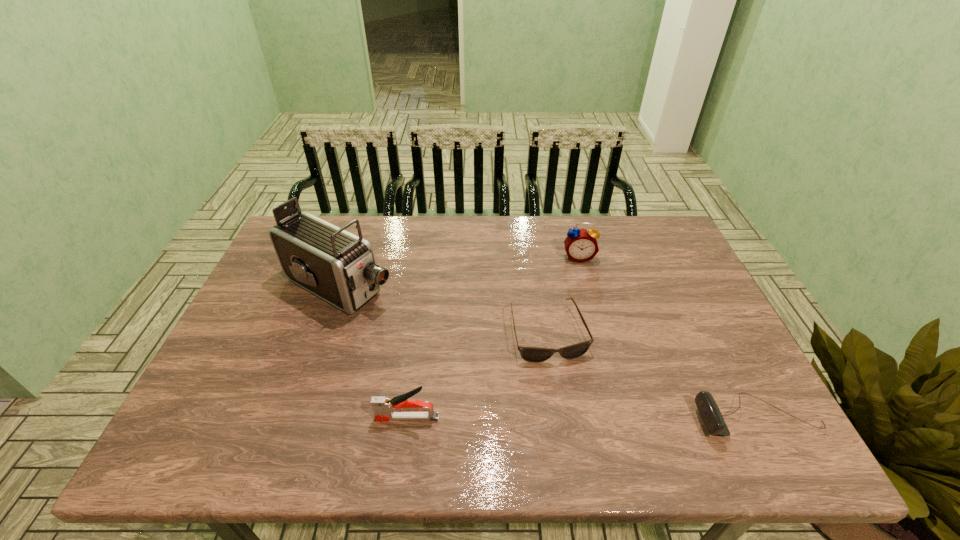
This screenshot has width=960, height=540. Identify the location of vacant space at the far edge of the desktop. (445, 226).

Locate an element on the screen. This screenshot has width=960, height=540. vacant space at the near edge is located at coordinates (629, 410).

Identify the location of free space at the left edge of the desktop. This screenshot has height=540, width=960. (272, 321).

In the image, there is a desktop. Where is `free space at the right edge`? free space at the right edge is located at coordinates (665, 309).

Locate an element on the screen. This screenshot has width=960, height=540. blank area at the far right corner is located at coordinates (669, 251).

Locate an element on the screen. Image resolution: width=960 pixels, height=540 pixels. vacant area between the second tallest object and the shortest object is located at coordinates (564, 294).

Where is `free point between the sunglasses and the alarm clock`? This screenshot has height=540, width=960. free point between the sunglasses and the alarm clock is located at coordinates (564, 294).

Locate an element on the screen. The width and height of the screenshot is (960, 540). blank region between the third shortest object and the webcam is located at coordinates (583, 417).

Locate an element on the screen. This screenshot has width=960, height=540. free area in between the sunglasses and the alarm clock is located at coordinates (564, 294).

Find the location of a particular element. free spot between the second shortest object and the sunglasses is located at coordinates (653, 375).